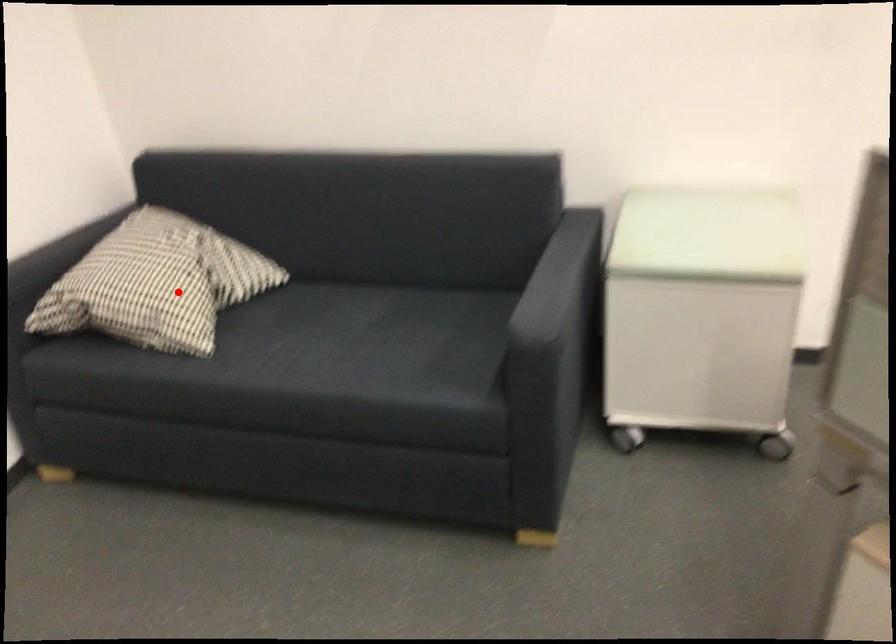
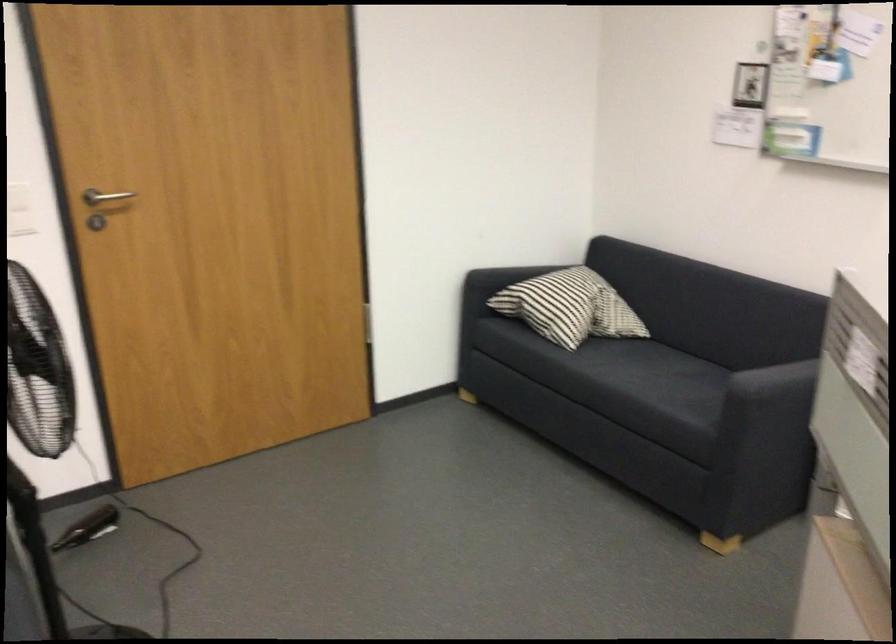
Locate, in the second image, the point that corresponds to the highlighted location in the first image.

(570, 307)